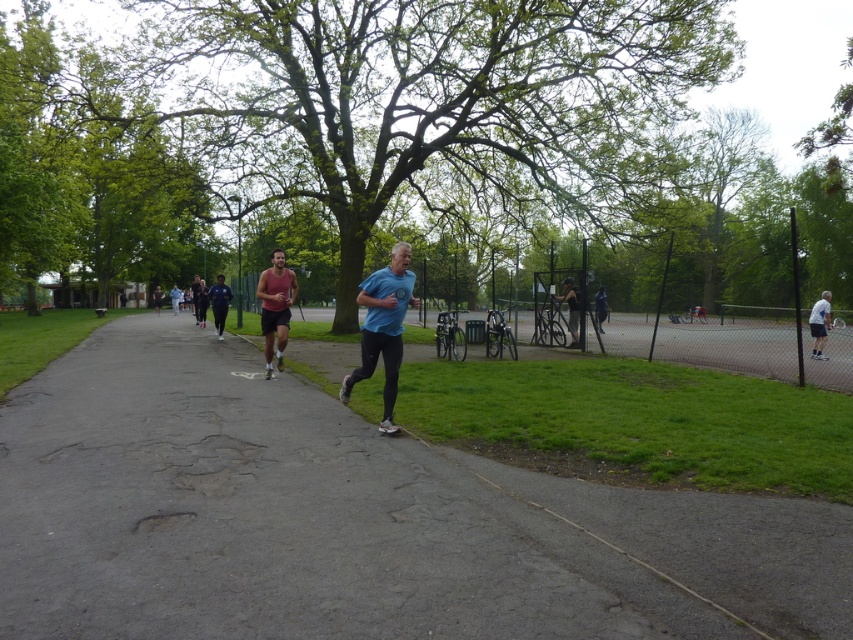
You are standing at the edge of the park path and want to take a photo of both the matte red tank top at center and the dark blue fabric pants at left. Which one should you focus on first to ensure both are in sharp focus?

You should focus on the matte red tank top at center first because it is closer to the viewer than the dark blue fabric pants at left, so adjusting focus from near to far will help both be in focus.

You are standing at the entrance of the park and see two runners, the blue matte shirt at center and the dark blue jersey at center. Which runner is nearer to you?

The blue matte shirt at center is closer to the viewer than the dark blue jersey at center, so the blue matte shirt at center is nearer to you.